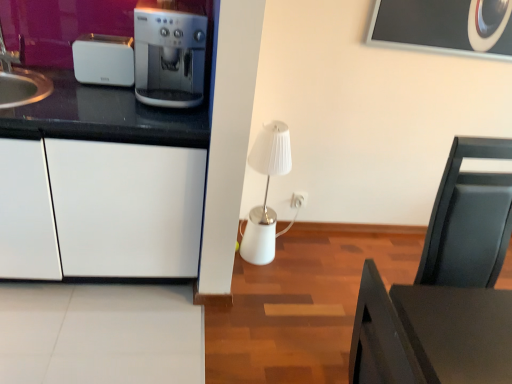
Question: Is satin silver coffee machine at left wider than white plastic electric outlet at center-right?

Choices:
 (A) no
 (B) yes

Answer: (B)

Question: Is satin silver coffee machine at left at the left side of white plastic electric outlet at center-right?

Choices:
 (A) yes
 (B) no

Answer: (A)

Question: From a real-world perspective, is satin silver coffee machine at left beneath white plastic electric outlet at center-right?

Choices:
 (A) yes
 (B) no

Answer: (B)

Question: Is satin silver coffee machine at left in front of white plastic electric outlet at center-right?

Choices:
 (A) yes
 (B) no

Answer: (A)

Question: From the image's perspective, does satin silver coffee machine at left appear higher than white plastic electric outlet at center-right?

Choices:
 (A) yes
 (B) no

Answer: (A)

Question: Is satin silver coffee machine at left aimed at white plastic electric outlet at center-right?

Choices:
 (A) no
 (B) yes

Answer: (A)

Question: Can you confirm if white plastic toaster at left is smaller than black matte table at lower right?

Choices:
 (A) no
 (B) yes

Answer: (B)

Question: Is white plastic toaster at left taller than black matte table at lower right?

Choices:
 (A) yes
 (B) no

Answer: (B)

Question: Considering the relative sizes of white plastic toaster at left and black matte table at lower right in the image provided, is white plastic toaster at left bigger than black matte table at lower right?

Choices:
 (A) yes
 (B) no

Answer: (B)

Question: Is white plastic toaster at left positioned before black matte table at lower right?

Choices:
 (A) yes
 (B) no

Answer: (B)

Question: Is black matte table at lower right at the back of white plastic toaster at left?

Choices:
 (A) yes
 (B) no

Answer: (B)

Question: Is white plastic toaster at left located outside black matte table at lower right?

Choices:
 (A) yes
 (B) no

Answer: (A)

Question: From a real-world perspective, is white plastic electric outlet at center-right located higher than white plastic toaster at left?

Choices:
 (A) no
 (B) yes

Answer: (A)